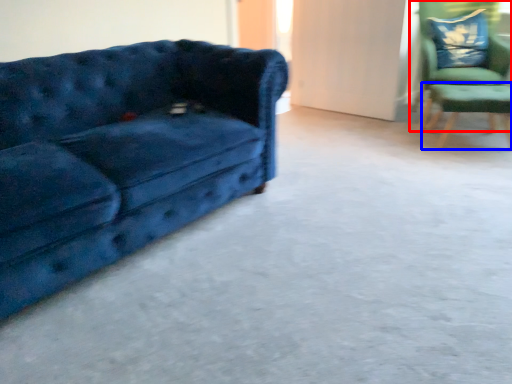
Question: Which object is further to the camera taking this photo, chair (highlighted by a red box) or side table (highlighted by a blue box)?

Choices:
 (A) chair
 (B) side table

Answer: (A)